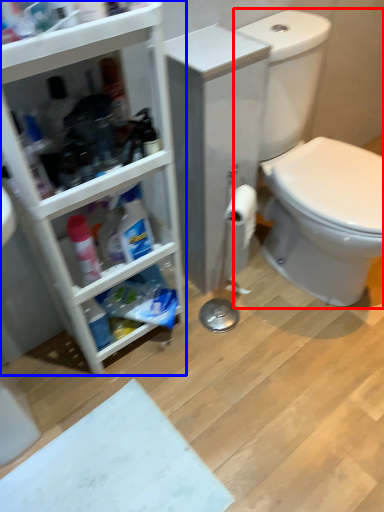
Question: Which of the following is the closest to the observer, sit (highlighted by a red box) or bathroom cabinet (highlighted by a blue box)?

Choices:
 (A) sit
 (B) bathroom cabinet

Answer: (B)